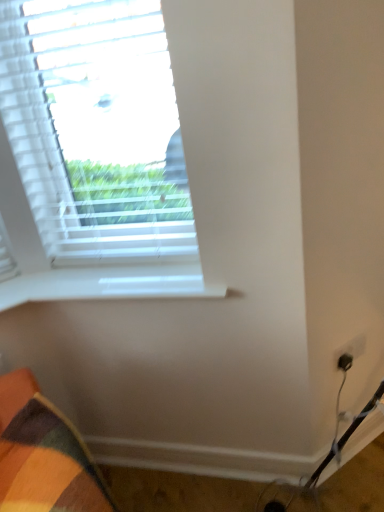
The image size is (384, 512). What do you see at coordinates (109, 284) in the screenshot?
I see `white smooth window sill at upper left` at bounding box center [109, 284].

You are a GUI agent. You are given a task and a screenshot of the screen. Output one action in this format:
    pyautogui.click(x=<x>, y=<y>)
    Task: Click on the white smooth window sill at upper left
    
    Given the screenshot: What is the action you would take?
    pyautogui.click(x=109, y=284)

What is the approximate height of white smooth window sill at upper left?

white smooth window sill at upper left is 2.06 inches tall.

This screenshot has width=384, height=512. What do you see at coordinates (92, 156) in the screenshot? I see `white matte window at upper left` at bounding box center [92, 156].

Image resolution: width=384 pixels, height=512 pixels. I want to click on white matte window at upper left, so click(x=92, y=156).

At what (x,y) coordinates should I click in order to perform the action: click on white smooth window sill at upper left. Please return your answer as a coordinate pair (x, y). Image resolution: width=384 pixels, height=512 pixels. Looking at the image, I should click on (109, 284).

Is white smooth window sill at upper left at the left side of white matte window at upper left?

In fact, white smooth window sill at upper left is to the right of white matte window at upper left.

Considering their positions, is white smooth window sill at upper left located in front of or behind white matte window at upper left?

Visually, white smooth window sill at upper left is located behind white matte window at upper left.

Is point (139, 294) more distant than point (139, 32)?

Yes, point (139, 294) is farther from viewer.

From the image's perspective, is white smooth window sill at upper left beneath white matte window at upper left?

Yes, from the image's perspective, white smooth window sill at upper left is beneath white matte window at upper left.

From a real-world perspective, is white smooth window sill at upper left over white matte window at upper left?

No.

Can you confirm if white smooth window sill at upper left is wider than white matte window at upper left?

Indeed, white smooth window sill at upper left has a greater width compared to white matte window at upper left.

Who is shorter, white smooth window sill at upper left or white matte window at upper left?

Standing shorter between the two is white smooth window sill at upper left.

Is white smooth window sill at upper left bigger than white matte window at upper left?

Actually, white smooth window sill at upper left might be smaller than white matte window at upper left.

Is white smooth window sill at upper left not within white matte window at upper left?

Yes, white smooth window sill at upper left is located beyond the bounds of white matte window at upper left.

Is white smooth window sill at upper left next to white matte window at upper left and touching it?

No.

Could you tell me if white smooth window sill at upper left is facing white matte window at upper left?

No, white smooth window sill at upper left is not turned towards white matte window at upper left.

What's the angular difference between white smooth window sill at upper left and white matte window at upper left's facing directions?

2.33 degrees.

What are the coordinates of `window sill on the right of the white matte window at upper left` in the screenshot? It's located at (109, 284).

In the image, is white matte window at upper left on the left side or the right side of white smooth window sill at upper left?

white matte window at upper left is to the left of white smooth window sill at upper left.

Considering the relative positions of white matte window at upper left and white smooth window sill at upper left in the image provided, is white matte window at upper left behind white smooth window sill at upper left?

No, it is in front of white smooth window sill at upper left.

Does point (103, 31) appear closer or farther from the camera than point (47, 273)?

Point (103, 31) appears to be closer to the viewer than point (47, 273).

In the scene shown: From the image's perspective, which object appears higher, white matte window at upper left or white smooth window sill at upper left?

white matte window at upper left is shown above in the image.

From a real-world perspective, is white matte window at upper left located beneath white smooth window sill at upper left?

Incorrect, from a real-world perspective, white matte window at upper left is higher than white smooth window sill at upper left.

In the scene shown: Is white matte window at upper left wider or thinner than white smooth window sill at upper left?

white matte window at upper left is thinner than white smooth window sill at upper left.

Is white matte window at upper left taller than white smooth window sill at upper left?

Indeed, white matte window at upper left has a greater height compared to white smooth window sill at upper left.

Who is bigger, white matte window at upper left or white smooth window sill at upper left?

white matte window at upper left.

Can we say white matte window at upper left lies outside white smooth window sill at upper left?

Absolutely, white matte window at upper left is external to white smooth window sill at upper left.

Is white matte window at upper left placed right next to white smooth window sill at upper left?

No, white matte window at upper left is not with white smooth window sill at upper left.

Is white matte window at upper left facing away from white smooth window sill at upper left?

No, white matte window at upper left is not facing the opposite direction of white smooth window sill at upper left.

What's the angular difference between white matte window at upper left and white smooth window sill at upper left's facing directions?

2.33 degrees.

Measure the distance between white matte window at upper left and white smooth window sill at upper left.

They are 27.48 centimeters apart.

This screenshot has width=384, height=512. What are the coordinates of `window in front of the white smooth window sill at upper left` in the screenshot? It's located at (92, 156).

Image resolution: width=384 pixels, height=512 pixels. Find the location of `window sill behind the white matte window at upper left`. window sill behind the white matte window at upper left is located at coordinates (109, 284).

Where is `window above the white smooth window sill at upper left (from a real-world perspective)`? This screenshot has width=384, height=512. window above the white smooth window sill at upper left (from a real-world perspective) is located at coordinates (92, 156).